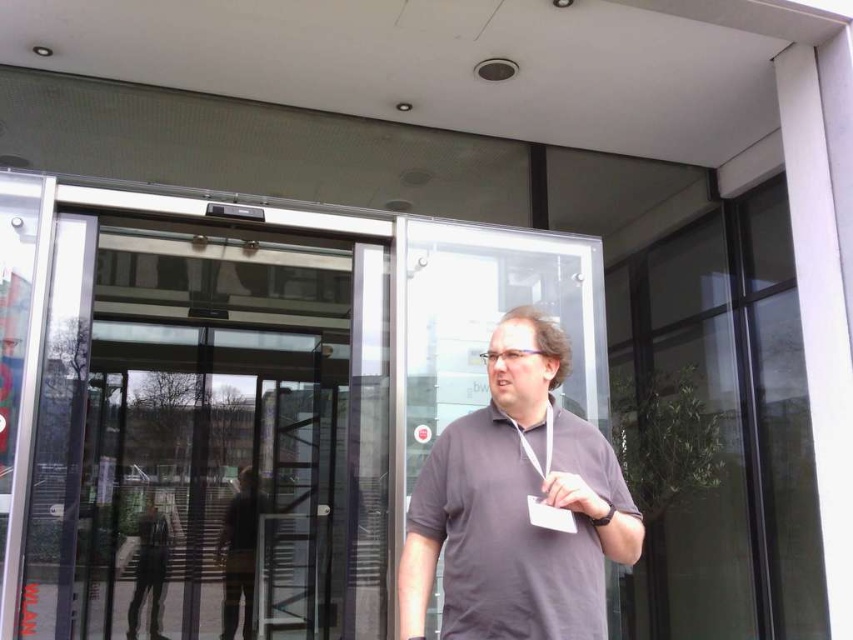
Question: Is transparent glass door at center above matte gray wristwatch at center?

Choices:
 (A) no
 (B) yes

Answer: (A)

Question: In this image, where is transparent glass door at center located relative to gray matte shirt at center?

Choices:
 (A) below
 (B) above

Answer: (A)

Question: Where is transparent glass door at center located in relation to matte gray wristwatch at center in the image?

Choices:
 (A) right
 (B) left

Answer: (B)

Question: Which point appears closest to the camera in this image?

Choices:
 (A) (604, 509)
 (B) (180, 564)

Answer: (A)

Question: Among these points, which one is farthest from the camera?

Choices:
 (A) (521, 323)
 (B) (279, 497)
 (C) (573, 476)

Answer: (B)

Question: Which of these objects is positioned closest to the transparent glass door at center?

Choices:
 (A) gray matte shirt at center
 (B) matte gray wristwatch at center

Answer: (A)